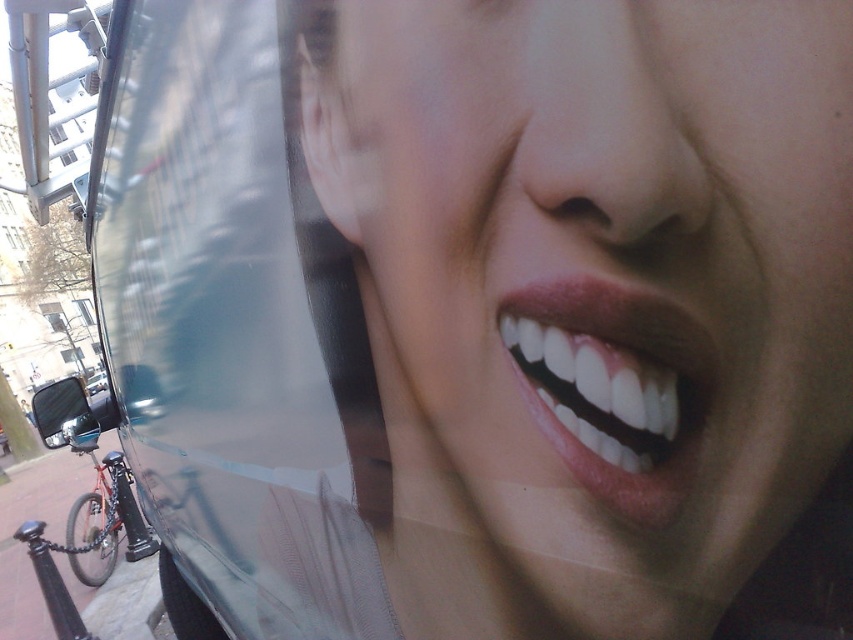
Question: Is matte skin face at center above transparent glass bus window at upper left?

Choices:
 (A) no
 (B) yes

Answer: (B)

Question: Which point is farther to the camera?

Choices:
 (A) matte pink lips at center
 (B) shiny metallic bicycle at lower left

Answer: (B)

Question: Which of the following is the closest to the observer?

Choices:
 (A) matte skin face at center
 (B) matte pink lips at center
 (C) transparent glass bus window at upper left
 (D) shiny metallic bicycle at lower left

Answer: (A)

Question: Where is matte skin face at center located in relation to transparent glass bus window at upper left in the image?

Choices:
 (A) above
 (B) below

Answer: (A)

Question: Can you confirm if matte skin face at center is positioned to the left of shiny metallic bicycle at lower left?

Choices:
 (A) yes
 (B) no

Answer: (B)

Question: Which point is farther to the camera?

Choices:
 (A) (622, 314)
 (B) (76, 540)
 (C) (213, 81)

Answer: (B)